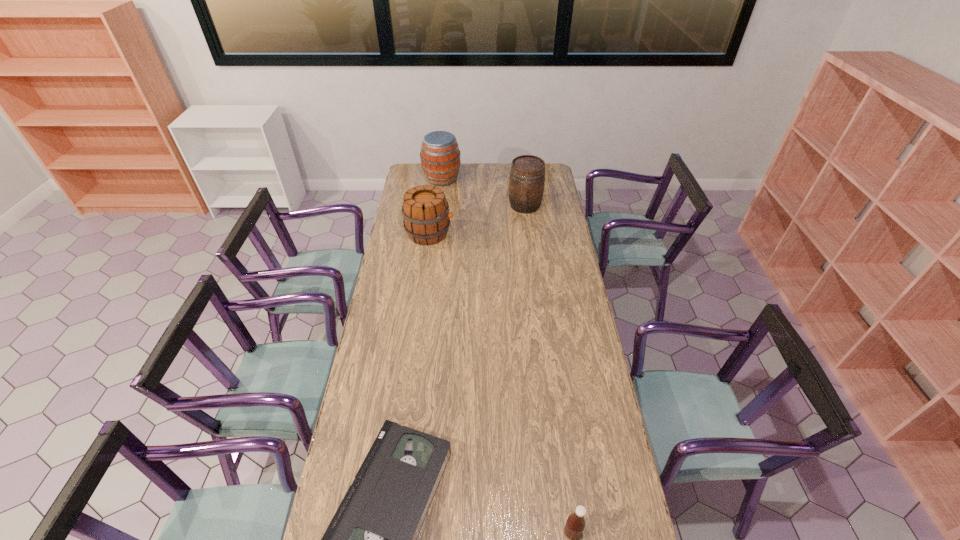
I want to click on vacant area at the far edge of the desktop, so click(477, 172).

This screenshot has width=960, height=540. Find the location of `free point at the left edge`. free point at the left edge is located at coordinates (403, 313).

You are a GUI agent. You are given a task and a screenshot of the screen. Output one action in this format:
    pyautogui.click(x=<x>, y=<y>)
    Task: Click on the free space at the right edge of the desktop
    The image size is (960, 540).
    Given the screenshot: What is the action you would take?
    pyautogui.click(x=569, y=444)

In the image, there is a desktop. Where is `free region at the far right corner`? free region at the far right corner is located at coordinates (546, 183).

At what (x,y) coordinates should I click in order to perform the action: click on empty space between the farthest cider and the second farthest cider. Please return your answer as a coordinate pair (x, y). The image size is (960, 540). Looking at the image, I should click on (484, 192).

Locate an element on the screen. This screenshot has width=960, height=540. the third closest object relative to the videotape is located at coordinates tap(527, 174).

Image resolution: width=960 pixels, height=540 pixels. What are the coordinates of `the closest object to the videotape` in the screenshot? It's located at (575, 524).

Locate an element on the screen. The image size is (960, 540). the second closest cider relative to the farthest object is located at coordinates coord(426,214).

Identify the location of cider that is the closest one to the videotape. (426, 214).

Image resolution: width=960 pixels, height=540 pixels. What are the coordinates of `vacant region that satisfies the following two spatial constraints: 1. on the side of the second nearest cider near the bung hole; 2. on the side of the third nearest object where the spigot is located` in the screenshot? It's located at (529, 233).